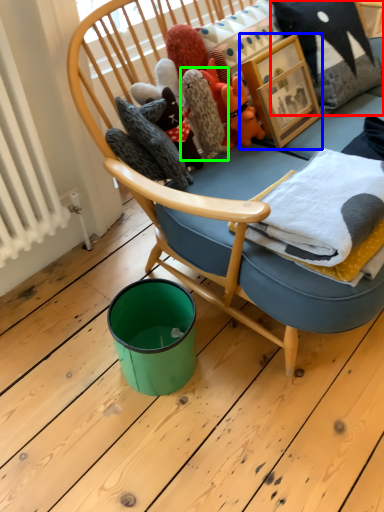
Question: Estimate the real-world distances between objects in this image. Which object is farther from pillow (highlighted by a red box), picture frame (highlighted by a blue box) or cloth (highlighted by a green box)?

Choices:
 (A) picture frame
 (B) cloth

Answer: (B)